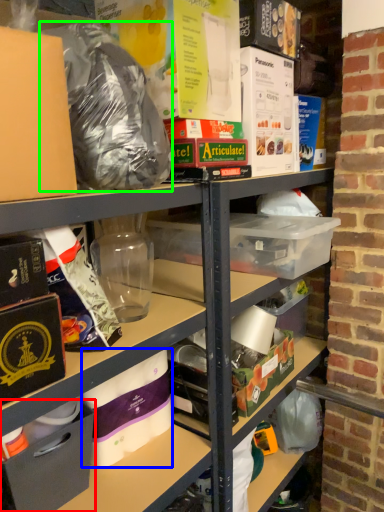
Question: Considering the real-world distances, which object is closest to box (highlighted by a red box)? toilet paper (highlighted by a blue box) or waste (highlighted by a green box).

Choices:
 (A) toilet paper
 (B) waste

Answer: (A)